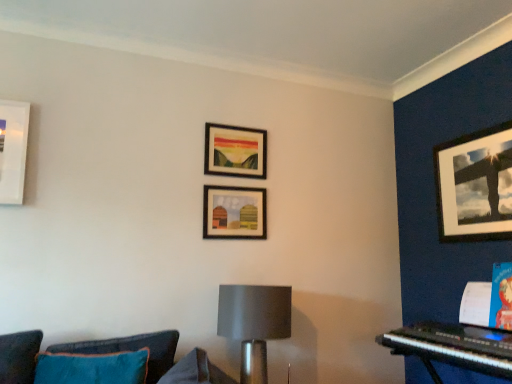
Question: Is matte black picture frame at upper center, the first picture frame from the left, inside the boundaries of black plastic keyboard at lower right, or outside?

Choices:
 (A) outside
 (B) inside

Answer: (A)

Question: Based on their sizes in the image, would you say matte black picture frame at upper center, the first picture frame from the left, is bigger or smaller than black plastic keyboard at lower right?

Choices:
 (A) big
 (B) small

Answer: (B)

Question: Considering the real-world distances, which object is farthest from the matte black picture frame at upper right, the first picture frame from the right?

Choices:
 (A) matte black picture frame at upper center, acting as the 3th picture frame starting from the right
 (B) matte gray lampshade at center
 (C) teal fabric couch at lower left
 (D) black plastic keyboard at lower right
 (E) matte wooden picture frame at center, which appears as the 2th picture frame when viewed from the left

Answer: (C)

Question: Which is nearer to the matte wooden picture frame at center, positioned as the second picture frame in right-to-left order?

Choices:
 (A) black plastic keyboard at lower right
 (B) matte gray lampshade at center
 (C) matte black picture frame at upper right, the first picture frame from the right
 (D) matte black picture frame at upper center, the first picture frame from the left
 (E) teal fabric couch at lower left

Answer: (D)